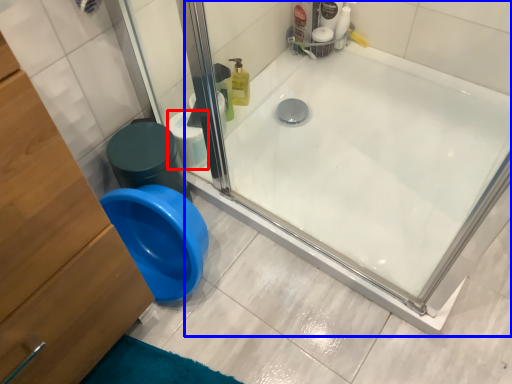
Question: Among these objects, which one is nearest to the camera, toilet paper (highlighted by a red box) or bathtub (highlighted by a blue box)?

Choices:
 (A) toilet paper
 (B) bathtub

Answer: (B)